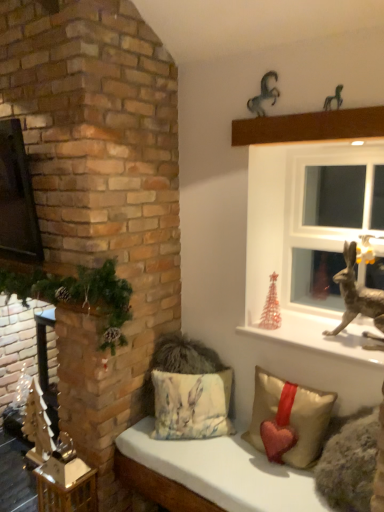
Locate an element on the screen. This screenshot has width=384, height=512. vacant space in front of translucent glass christmas tree at right, marked as the 2th christmas decoration in a left-to-right arrangement is located at coordinates (286, 336).